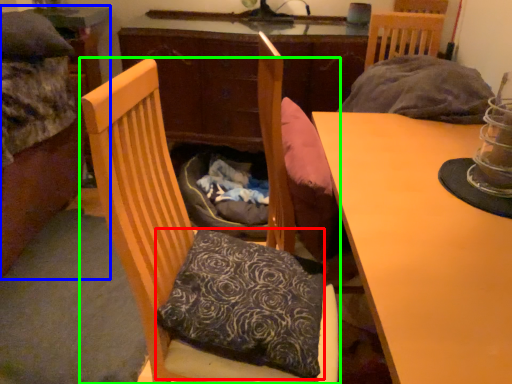
Question: Based on their relative distances, which object is nearer to pillow (highlighted by a red box)? Choose from bed (highlighted by a blue box) and chair (highlighted by a green box).

Choices:
 (A) bed
 (B) chair

Answer: (B)